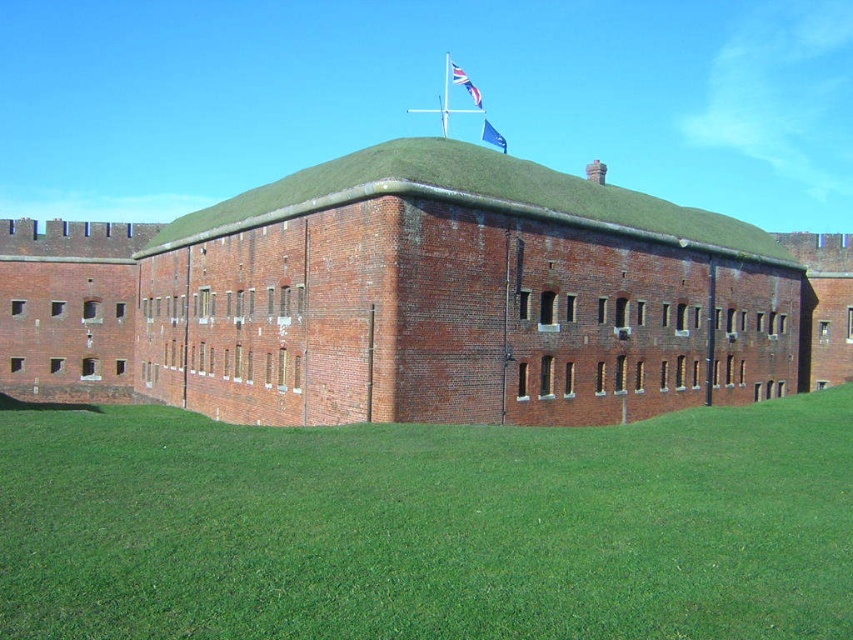
Question: Does green grass at lower center have a greater width compared to red brick building at center?

Choices:
 (A) yes
 (B) no

Answer: (B)

Question: Among these points, which one is farthest from the camera?

Choices:
 (A) (91, 477)
 (B) (450, 68)
 (C) (448, 193)
 (D) (496, 138)

Answer: (B)

Question: Can you confirm if green grass at lower center is positioned to the right of red brick building at center?

Choices:
 (A) yes
 (B) no

Answer: (A)

Question: Where is green grass at lower center located in relation to green grassy roof at center in the image?

Choices:
 (A) right
 (B) left

Answer: (B)

Question: Which of the following is the closest to the observer?

Choices:
 (A) union jack fabric flag at upper center
 (B) blue fabric flag at center
 (C) green grassy roof at center

Answer: (C)

Question: Which point appears farthest from the camera in this image?

Choices:
 (A) (503, 499)
 (B) (517, 196)
 (C) (668, 204)
 (D) (494, 138)

Answer: (D)